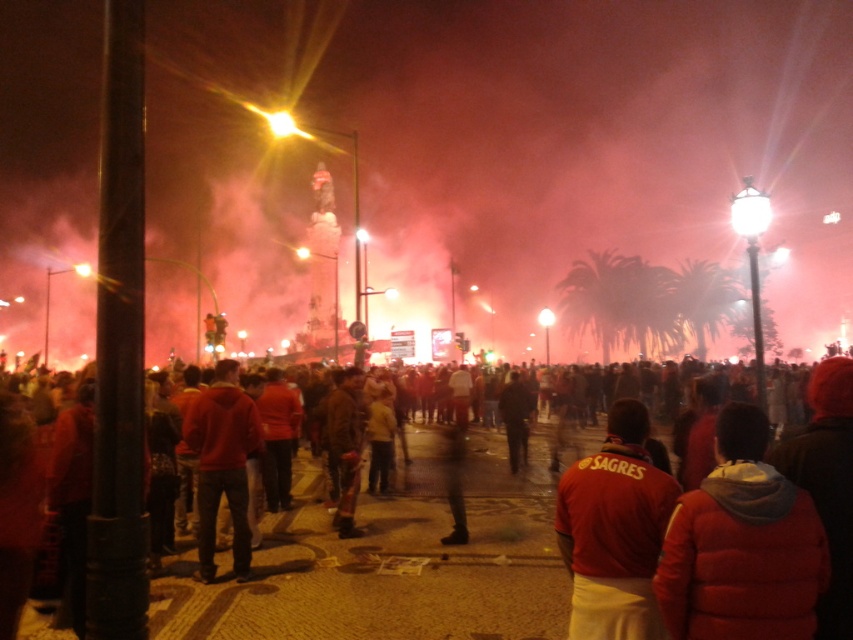
You are a photographer at the event and want to capture both the red puffer jacket at lower right and the red matte jacket at lower right in a single frame. Which jacket will appear wider in the photo?

The red puffer jacket at lower right will appear wider in the photo because its width is larger than the red matte jacket at lower right.

You are at a nighttime event and see two people wearing red jackets. One is wearing a red fabric jacket at center and the other a red puffer jacket at lower right. Which jacket is positioned more to the left?

The red fabric jacket at center is positioned more to the left than the red puffer jacket at lower right.